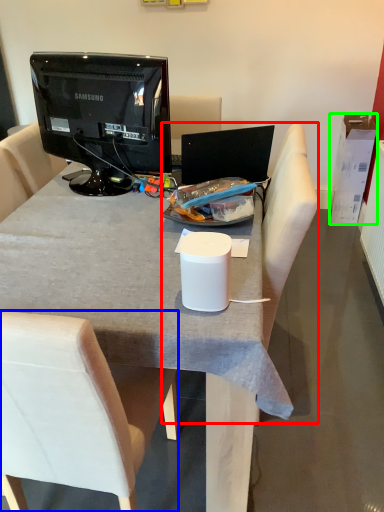
Question: Which object is the closest to the armchair (highlighted by a red box)? Choose among these: chair (highlighted by a blue box) or box (highlighted by a green box).

Choices:
 (A) chair
 (B) box

Answer: (A)